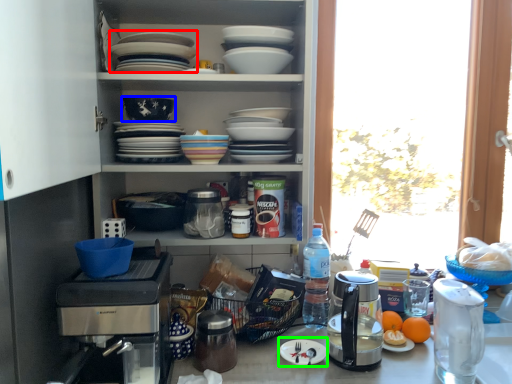
Question: Which is nearer to the platter (highlighted by a red box)? bowl (highlighted by a blue box) or paper plate (highlighted by a green box).

Choices:
 (A) bowl
 (B) paper plate

Answer: (A)